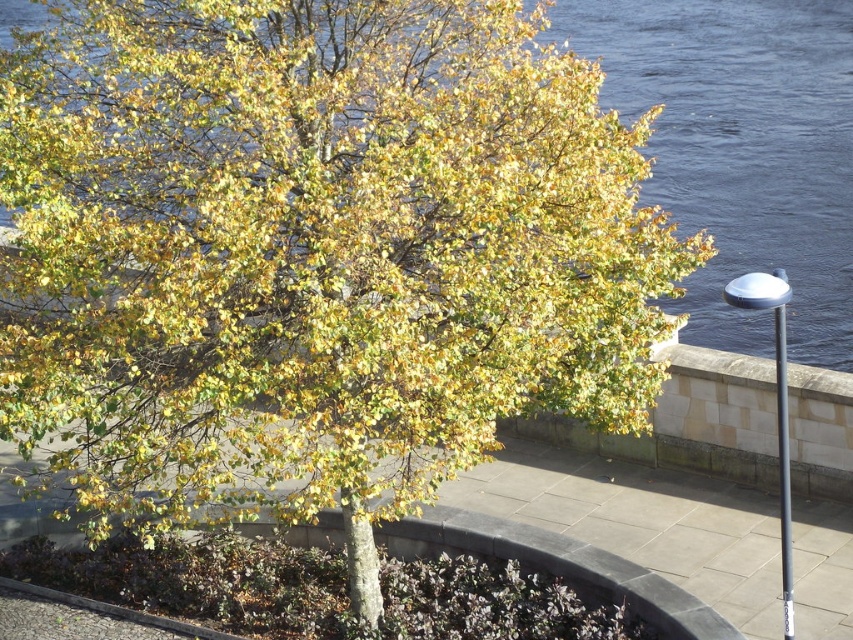
Does gray concrete pavement at center have a larger size compared to sleek metallic pole at right?

Yes, gray concrete pavement at center is bigger than sleek metallic pole at right.

Between point (538, 499) and point (780, 410), which one is positioned in front?

Point (780, 410) is in front.

In order to click on gray concrete pavement at center in this screenshot , I will do `click(640, 513)`.